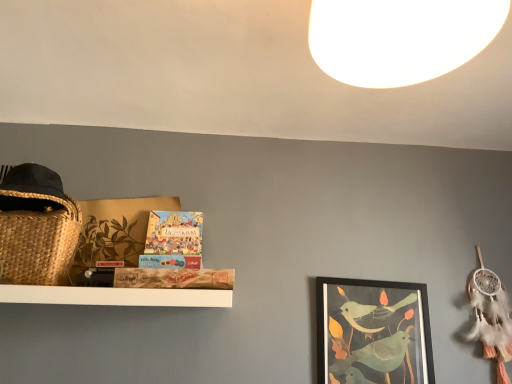
Question: Is matte board game at center shorter than matte black picture frame at center right?

Choices:
 (A) no
 (B) yes

Answer: (B)

Question: From a real-world perspective, does matte board game at center sit lower than matte black picture frame at center right?

Choices:
 (A) no
 (B) yes

Answer: (A)

Question: From the image's perspective, is matte board game at center on top of matte black picture frame at center right?

Choices:
 (A) yes
 (B) no

Answer: (A)

Question: Is matte black picture frame at center right a part of matte board game at center?

Choices:
 (A) yes
 (B) no

Answer: (B)

Question: Is matte board game at center taller than matte black picture frame at center right?

Choices:
 (A) yes
 (B) no

Answer: (B)

Question: From a real-world perspective, is matte board game at center above or below white matte light at upper center?

Choices:
 (A) above
 (B) below

Answer: (B)

Question: Considering the positions of matte board game at center and white matte light at upper center in the image, is matte board game at center wider or thinner than white matte light at upper center?

Choices:
 (A) thin
 (B) wide

Answer: (A)

Question: In terms of height, does matte board game at center look taller or shorter compared to white matte light at upper center?

Choices:
 (A) tall
 (B) short

Answer: (A)

Question: Does point (181, 221) appear closer or farther from the camera than point (347, 8)?

Choices:
 (A) closer
 (B) farther

Answer: (B)

Question: Visually, is matte board game at center positioned to the left or to the right of matte black picture frame at center right?

Choices:
 (A) right
 (B) left

Answer: (B)

Question: From a real-world perspective, is matte board game at center physically located above or below matte black picture frame at center right?

Choices:
 (A) below
 (B) above

Answer: (B)

Question: Does point (147, 258) appear closer or farther from the camera than point (384, 375)?

Choices:
 (A) farther
 (B) closer

Answer: (B)

Question: From the image's perspective, is matte board game at center above or below matte black picture frame at center right?

Choices:
 (A) below
 (B) above

Answer: (B)

Question: Looking at their shapes, would you say white matte light at upper center is wider or thinner than matte board game at center?

Choices:
 (A) wide
 (B) thin

Answer: (A)

Question: Is white matte light at upper center bigger or smaller than matte board game at center?

Choices:
 (A) small
 (B) big

Answer: (B)